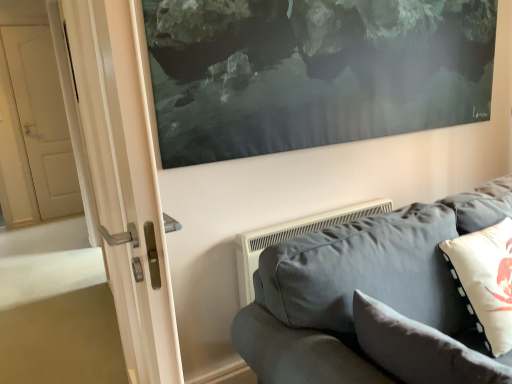
Question: Is velvet gray couch at lower right spatially inside soft gray cushion at lower right, which is the first pillow from left to right, or outside of it?

Choices:
 (A) inside
 (B) outside

Answer: (B)

Question: From the image's perspective, is velvet gray couch at lower right positioned above or below soft gray cushion at lower right, which is counted as the 2th pillow, starting from the right?

Choices:
 (A) above
 (B) below

Answer: (B)

Question: Which object is the closest to the velvet gray couch at lower right?

Choices:
 (A) soft gray cushion at lower right, which is the first pillow from left to right
 (B) white matte pillow at right, placed as the first pillow when sorted from right to left

Answer: (A)

Question: Estimate the real-world distances between objects in this image. Which object is closer to the velvet gray couch at lower right?

Choices:
 (A) white matte pillow at right, placed as the first pillow when sorted from right to left
 (B) soft gray cushion at lower right, which is the first pillow from left to right

Answer: (B)